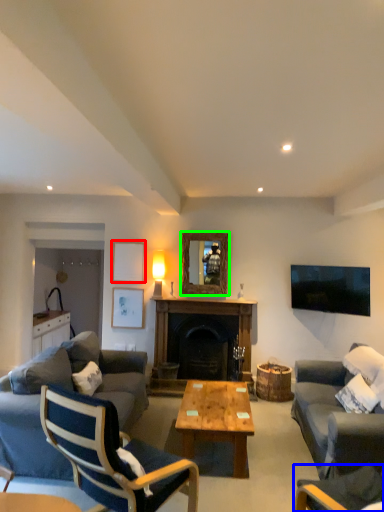
Question: Estimate the real-world distances between objects in this image. Which object is farther from picture frame (highlighted by a red box), chair (highlighted by a blue box) or mirror (highlighted by a green box)?

Choices:
 (A) chair
 (B) mirror

Answer: (A)